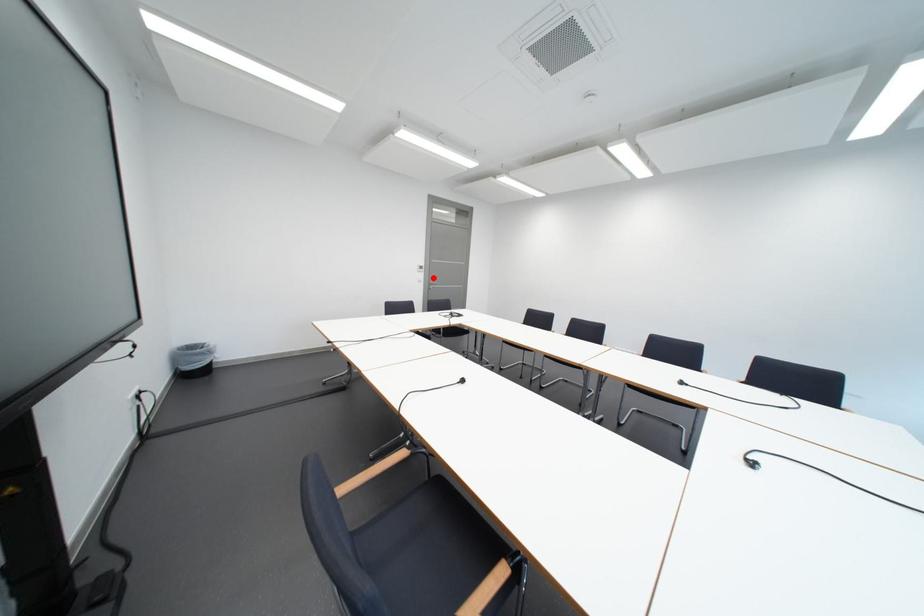
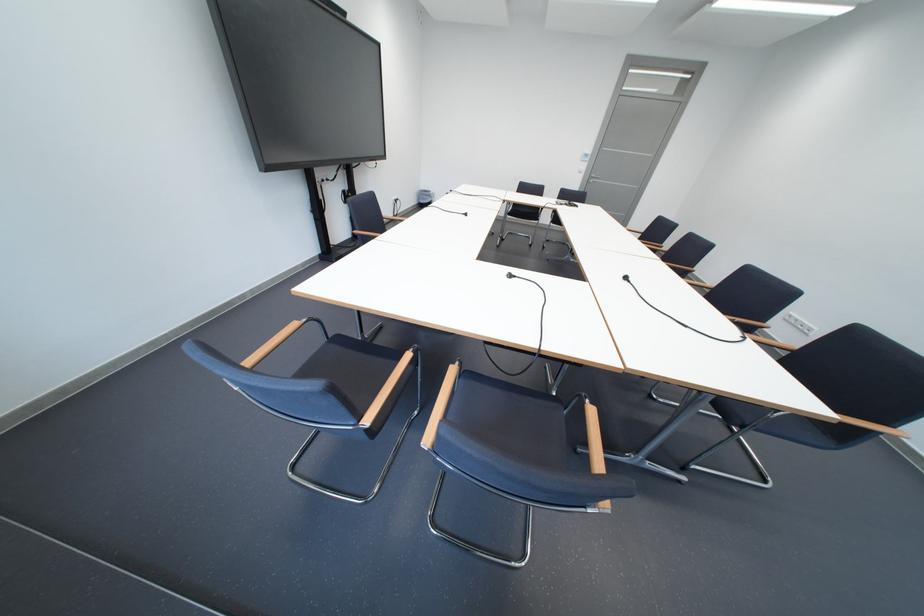
Question: I am providing you with two images of the same scene from different viewpoints. Given a red point in image1, look at the same physical point in image2. Is it:

Choices:
 (A) Closer to the viewpoint
 (B) Farther from the viewpoint

Answer: (A)